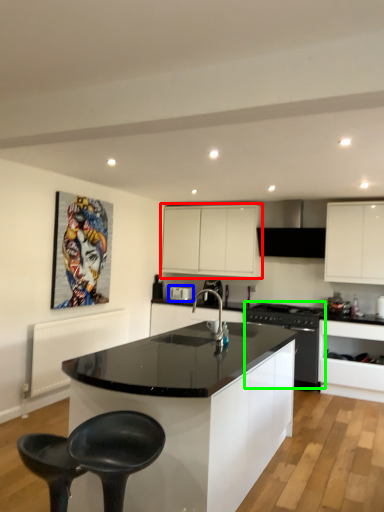
Question: Estimate the real-world distances between objects in this image. Which object is farther from cabinetry (highlighted by a red box), appliance (highlighted by a blue box) or kitchen appliance (highlighted by a green box)?

Choices:
 (A) appliance
 (B) kitchen appliance

Answer: (B)